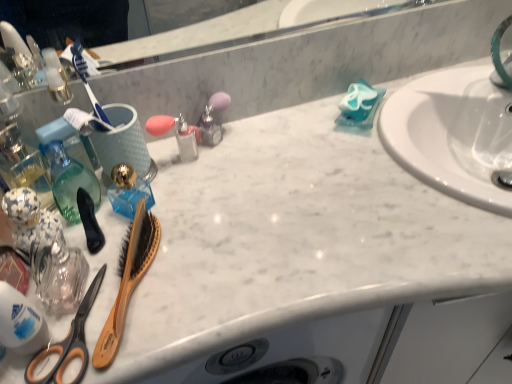
I want to click on vacant space that's between blue matte soap at upper right, which appears as the 1th cleaning product when viewed from the back, and wooden bristle brush at left, the first brush when ordered from right to left, so click(252, 195).